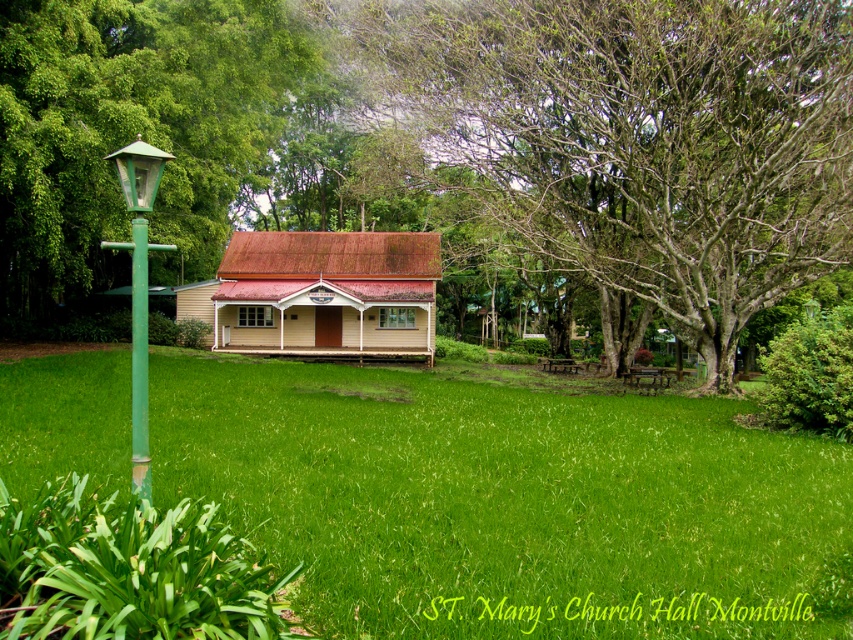
Question: Is green grass at center further to the viewer compared to green matte pole at left?

Choices:
 (A) no
 (B) yes

Answer: (A)

Question: Is the position of wooden hut at center less distant than that of green painted metal lamp post at left?

Choices:
 (A) no
 (B) yes

Answer: (A)

Question: Which object appears closest to the camera in this image?

Choices:
 (A) green leafy tree at left
 (B) green painted metal lamp post at left
 (C) smooth bark tree at center
 (D) green grass at center

Answer: (D)

Question: Which object is the closest to the wooden hut at center?

Choices:
 (A) green grass at center
 (B) smooth bark tree at center

Answer: (B)

Question: Which of the following is the farthest from the observer?

Choices:
 (A) green grass at center
 (B) green painted metal lamp post at left
 (C) wooden hut at center
 (D) smooth bark tree at center

Answer: (C)

Question: Does smooth bark tree at center appear on the right side of wooden hut at center?

Choices:
 (A) no
 (B) yes

Answer: (B)